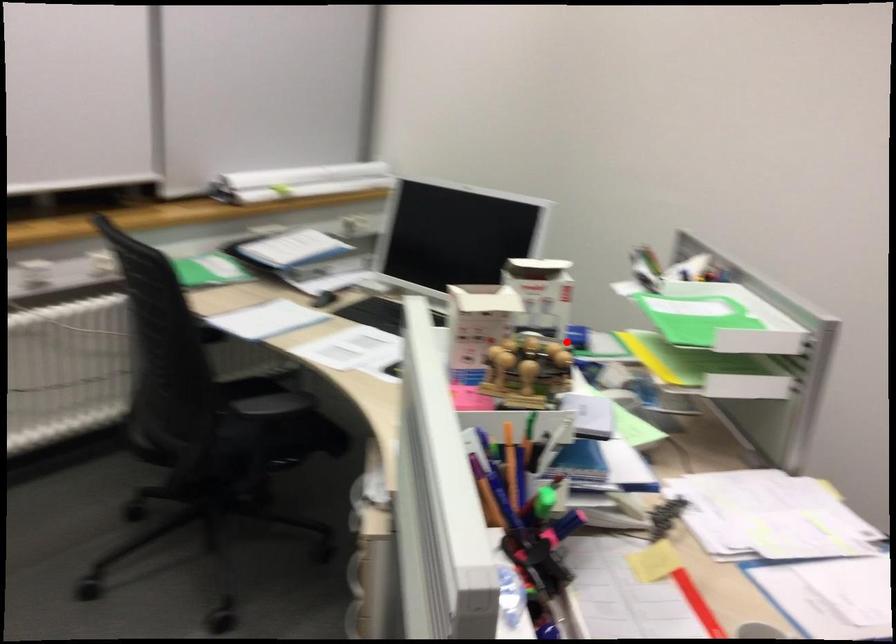
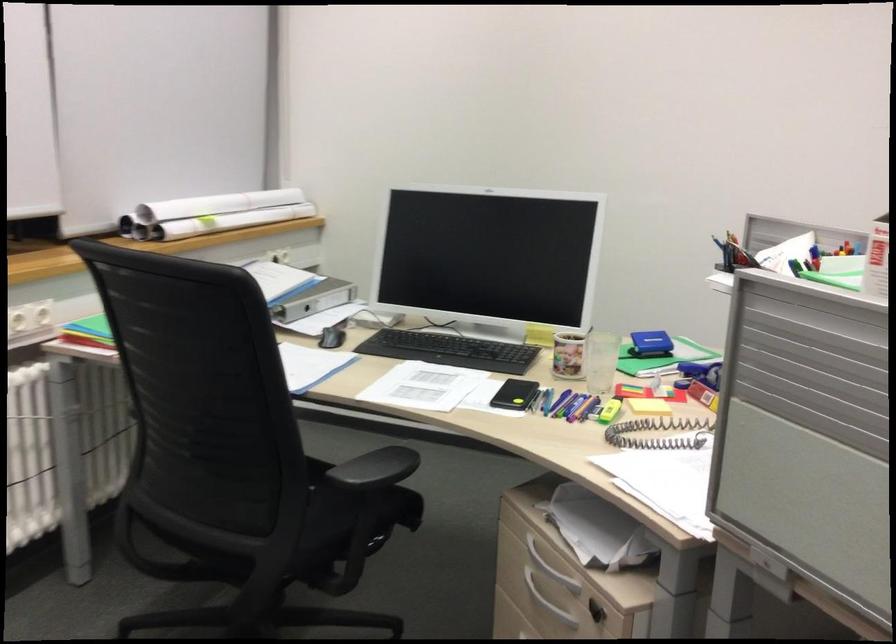
Question: I am providing you with two images of the same scene from different viewpoints. In image1, a red point is highlighted. Considering the same 3D point in image2, which of the following is correct?

Choices:
 (A) It is closer
 (B) It is farther

Answer: (A)